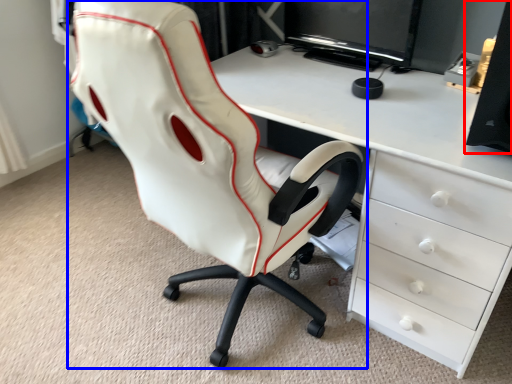
Question: Which object appears farthest to the camera in this image, speaker (highlighted by a red box) or chair (highlighted by a blue box)?

Choices:
 (A) speaker
 (B) chair

Answer: (A)